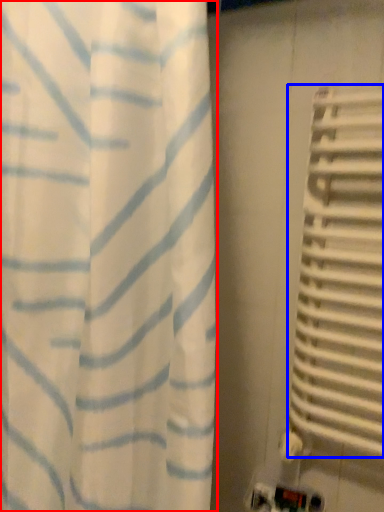
Question: Which object is further to the camera taking this photo, curtain (highlighted by a red box) or blind (highlighted by a blue box)?

Choices:
 (A) curtain
 (B) blind

Answer: (B)